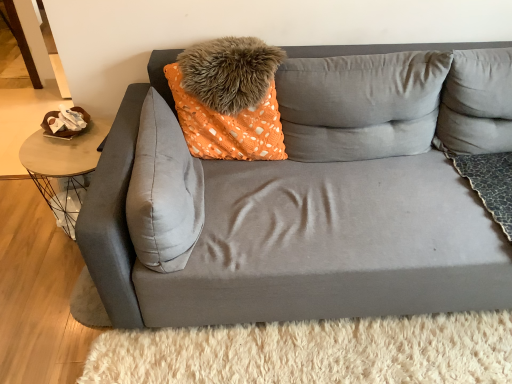
The width and height of the screenshot is (512, 384). I want to click on vacant area on top of metallic wire table at left (from a real-world perspective), so click(62, 149).